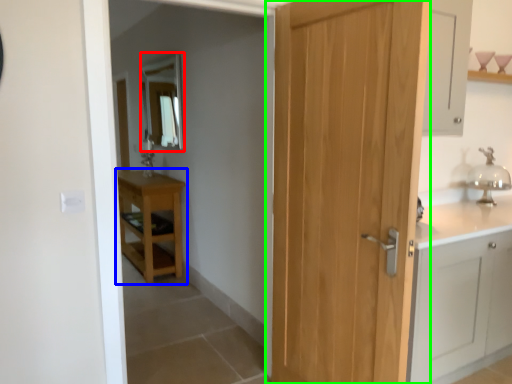
Question: Which object is positioned farthest from mirror (highlighted by a red box)? Select from table (highlighted by a blue box) and door (highlighted by a green box).

Choices:
 (A) table
 (B) door

Answer: (B)